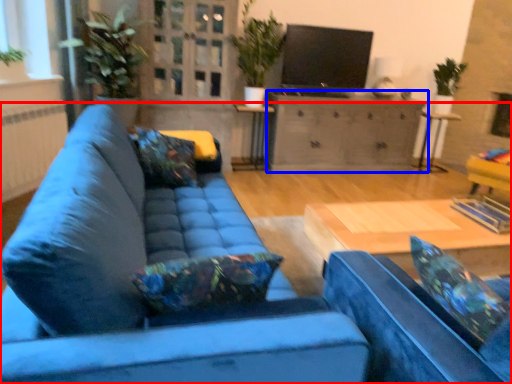
Question: Which of the following is the closest to the observer, studio couch (highlighted by a red box) or cabinetry (highlighted by a blue box)?

Choices:
 (A) studio couch
 (B) cabinetry

Answer: (A)